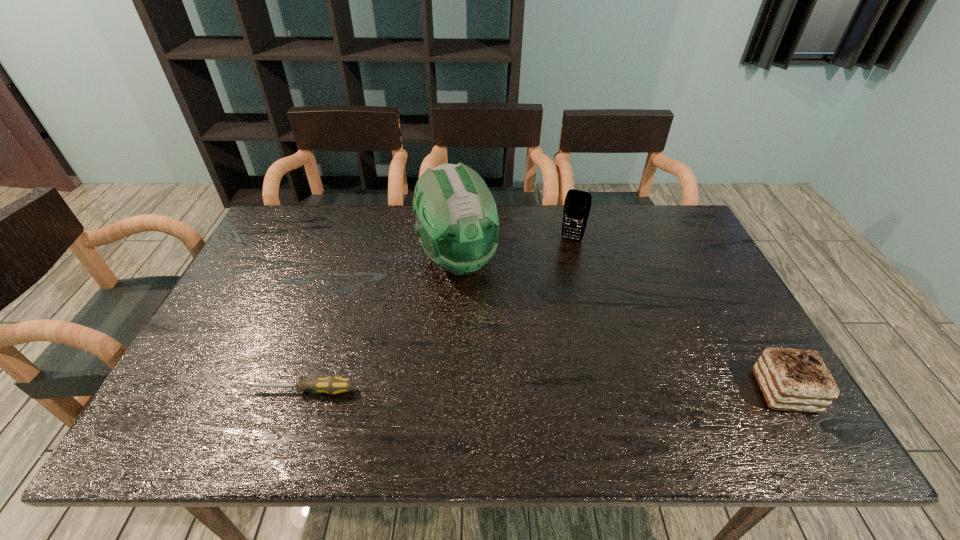
This screenshot has height=540, width=960. I want to click on object that is the closest to the second object from right to left, so click(457, 222).

Find the location of a particular element. The width and height of the screenshot is (960, 540). object that is the second closest to the screwdriver is located at coordinates (577, 204).